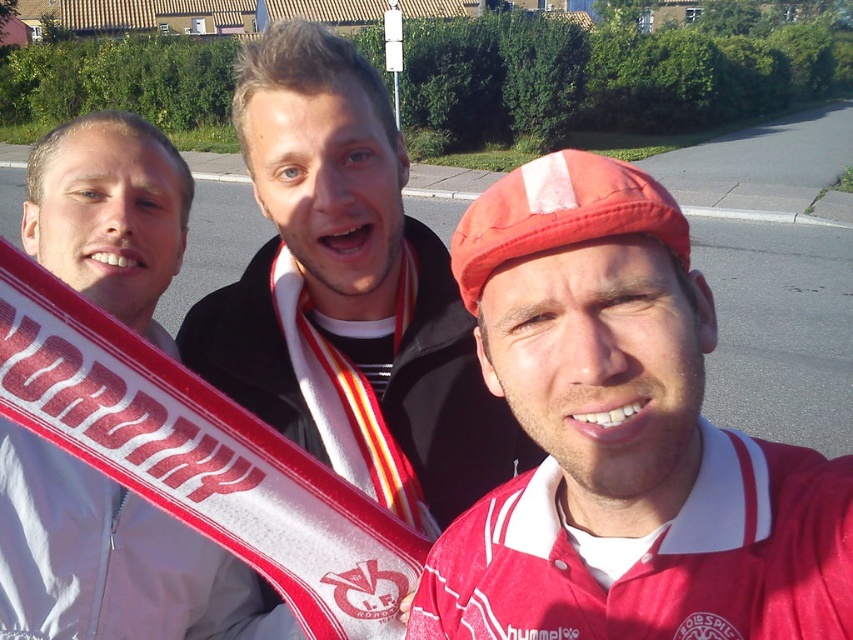
The width and height of the screenshot is (853, 640). I want to click on matte black jacket at center, so click(x=349, y=292).

Who is positioned more to the right, matte black jacket at center or white fabric scarf at left?

From the viewer's perspective, matte black jacket at center appears more on the right side.

Find the location of a particular element. Image resolution: width=853 pixels, height=640 pixels. matte black jacket at center is located at coordinates (349, 292).

Locate an element on the screen. The width and height of the screenshot is (853, 640). matte black jacket at center is located at coordinates (349, 292).

Does matte red cap at center appear over matte black jacket at center?

No.

Is matte red cap at center closer to the viewer compared to matte black jacket at center?

Yes, it is in front of matte black jacket at center.

This screenshot has width=853, height=640. In order to click on matte red cap at center in this screenshot , I will do `click(622, 440)`.

This screenshot has width=853, height=640. In order to click on matte red cap at center in this screenshot , I will do `click(622, 440)`.

What do you see at coordinates (622, 440) in the screenshot?
I see `matte red cap at center` at bounding box center [622, 440].

Is matte red cap at center to the right of white fabric scarf at left from the viewer's perspective?

Indeed, matte red cap at center is positioned on the right side of white fabric scarf at left.

Is point (685, 282) positioned behind point (281, 456)?

No, it is in front of (281, 456).

I want to click on matte red cap at center, so click(x=622, y=440).